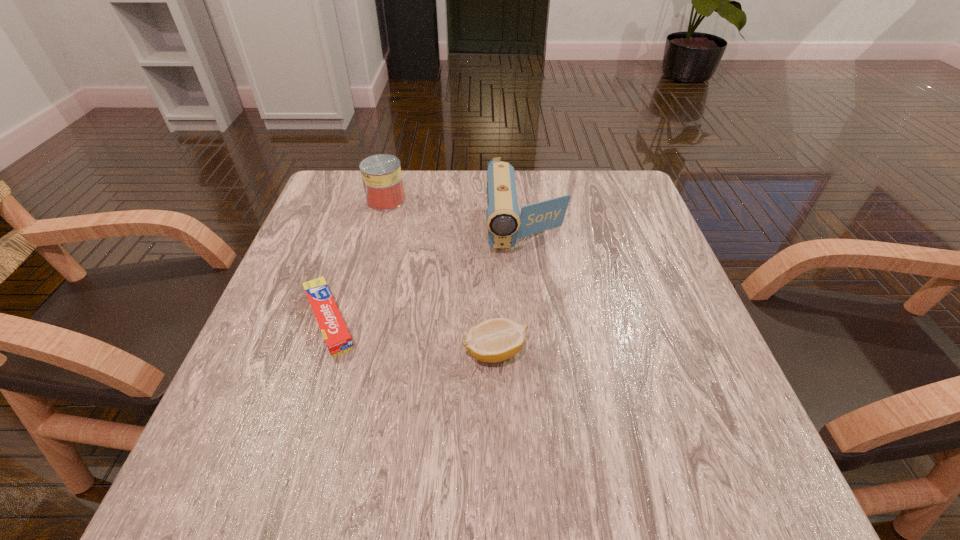
Locate an element on the screen. This screenshot has height=540, width=960. camcorder is located at coordinates (505, 224).

Identify the location of the third shortest object. (381, 174).

Find the location of `the third tallest object`. the third tallest object is located at coordinates (494, 340).

Where is `the shortest object`? Image resolution: width=960 pixels, height=540 pixels. the shortest object is located at coordinates (338, 340).

The height and width of the screenshot is (540, 960). I want to click on free space located 0.110m on the side of the tallest object with the flip-out screen, so click(x=536, y=302).

At what (x,y) coordinates should I click in order to perform the action: click on free location located 0.220m on the front of the second tallest object. Please return your answer as a coordinate pair (x, y). This screenshot has width=960, height=540. Looking at the image, I should click on (367, 272).

At what (x,y) coordinates should I click in order to perform the action: click on free region located on the front of the second shortest object. Please return your answer as a coordinate pair (x, y). Looking at the image, I should click on (496, 415).

I want to click on blank space located on the right of the toothpaste, so click(x=525, y=320).

Where is `camcorder that is positioned at the far edge`? camcorder that is positioned at the far edge is located at coordinates (505, 224).

Find the location of `can located in the far edge section of the desktop`. can located in the far edge section of the desktop is located at coordinates (381, 174).